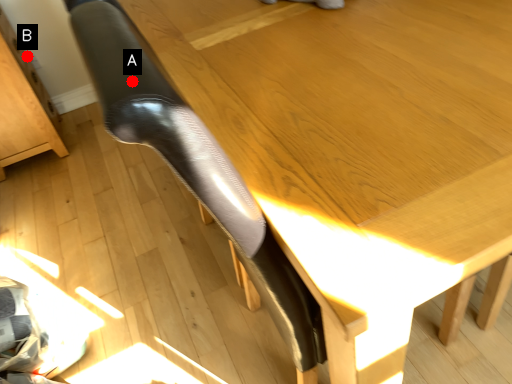
Question: Two points are circled on the image, labeled by A and B beside each circle. Which point is farther from the camera taking this photo?

Choices:
 (A) A is further
 (B) B is further

Answer: (B)